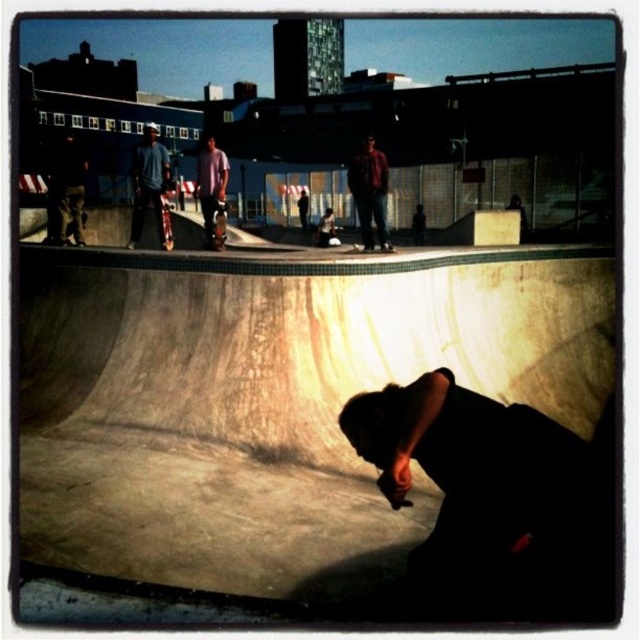
You are a photographer at the skatepark trying to capture a photo of the blue denim jeans at upper left and dark brown pants at left. Since you want both subjects to be in focus, which one should you focus on first to ensure the other is also in focus?

You should focus on the blue denim jeans at upper left first because it is closer to you than the dark brown pants at left, ensuring the dark brown pants at left will also be in focus due to depth of field.

You are a photographer positioned at the center of the skatepark. You want to capture a photo of the blue denim jeans at upper left. Based on their coordinates, in which direction should you move your camera to frame them properly?

The blue denim jeans at upper left are located at coordinates point [150,186]. Since the photographer is at the center, moving the camera slightly to the left and down would position the jeans within the frame.